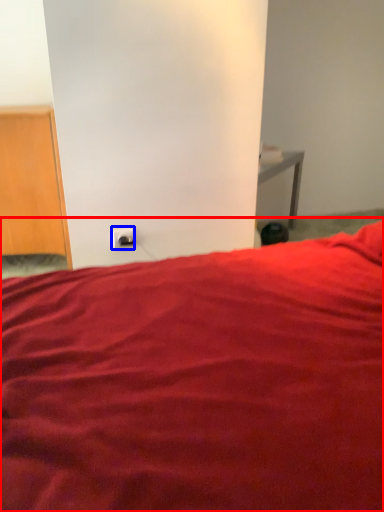
Question: Which object appears closest to the camera in this image, bed (highlighted by a red box) or electric outlet (highlighted by a blue box)?

Choices:
 (A) bed
 (B) electric outlet

Answer: (A)